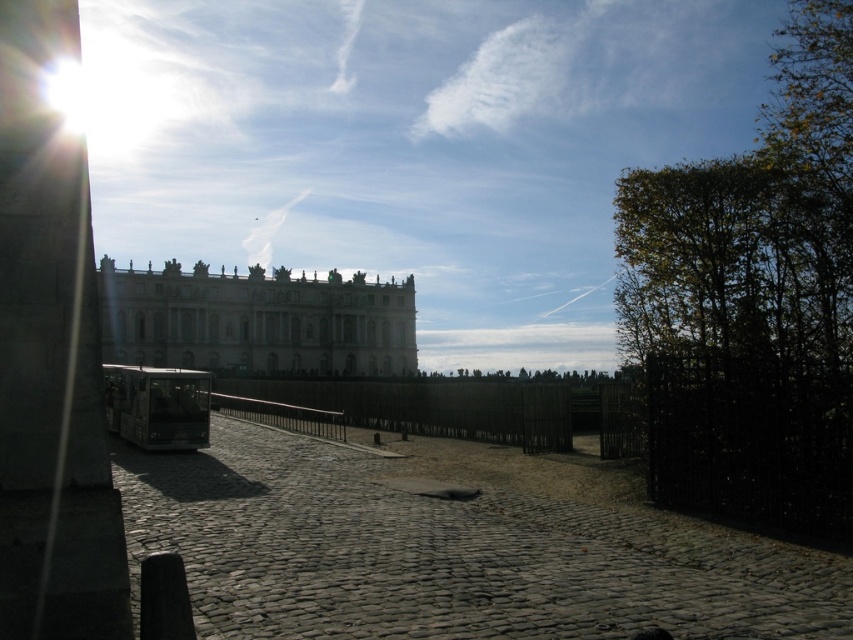
Which is below, green leafy tree at right or metallic bus at center?

metallic bus at center is below.

Does green leafy tree at right appear over metallic bus at center?

Indeed, green leafy tree at right is positioned over metallic bus at center.

I want to click on green leafy tree at right, so click(x=753, y=298).

Is white stone building at center closer to camera compared to metallic bus at center?

That is False.

Between point (102, 275) and point (194, 444), which one is positioned in front?

Point (194, 444) is more forward.

Find the location of a particular element. The image size is (853, 640). white stone building at center is located at coordinates (256, 321).

Between green leafy tree at right and white stone building at center, which one has more height?

Standing taller between the two is green leafy tree at right.

Between point (848, 212) and point (287, 321), which one is positioned behind?

The point (287, 321) is more distant.

Locate an element on the screen. The image size is (853, 640). green leafy tree at right is located at coordinates (753, 298).